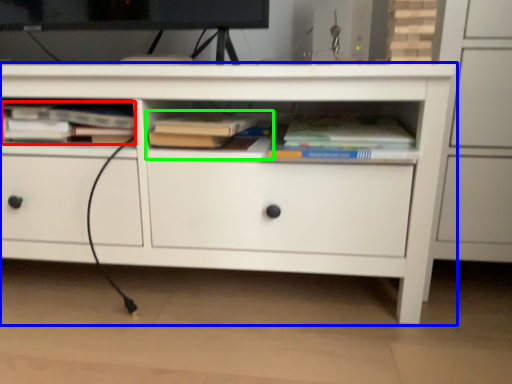
Question: Which object is the closest to the book (highlighted by a red box)? Choose among these: chest of drawers (highlighted by a blue box) or book (highlighted by a green box).

Choices:
 (A) chest of drawers
 (B) book

Answer: (B)